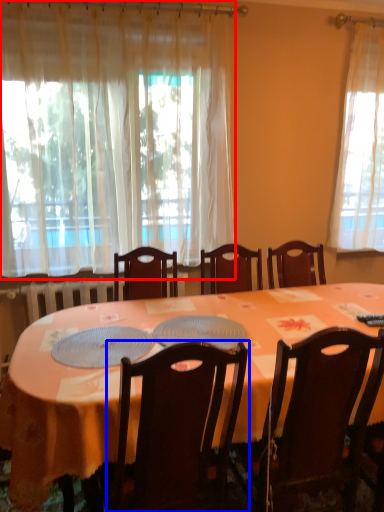
Question: Which object is closer to the camera taking this photo, curtain (highlighted by a red box) or chair (highlighted by a blue box)?

Choices:
 (A) curtain
 (B) chair

Answer: (B)